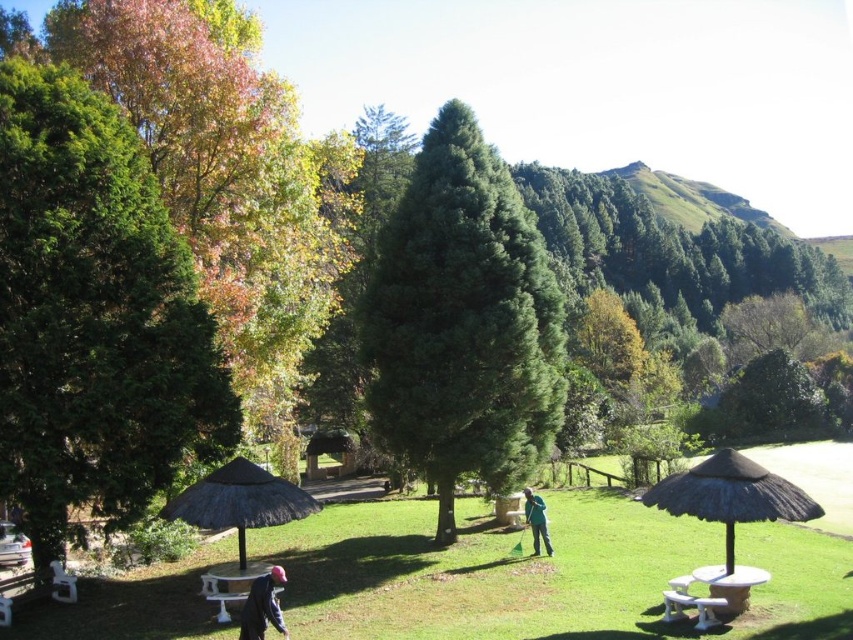
Consider the image. You are planning to set up a picnic under the black thatched umbrella at lower right. However, you need to ensure there is enough space for a 2m tall tent. Is the green matte tree at center an obstruction?

The green matte tree at center is positioned over the black thatched umbrella at lower right, which means the tree is directly above the umbrella. This would likely obstruct the placement of a 2m tall tent underneath, so the tree is an obstruction.

You are planning to place a 1.2 meter wide backpack on the ground between the dark blue jacket at lower left and the white glossy picnic table at lower left. Considering their widths, will the backpack fit without overlapping either object?

The dark blue jacket at lower left has a lesser width compared to the white glossy picnic table at lower left. Since the backpack is 1.2 meters wide, it depends on the available space between them. However, the description only provides relative width information, not the distance between the objects. Without knowing the exact distance, we cannot determine if the backpack will fit.

You are planning to set up a picnic in the park and have a large picnic basket. You see the white plastic table at center and the brown thatched hut at center. Which object can accommodate your picnic basket better based on their sizes?

The white plastic table at center has a larger size compared to the brown thatched hut at center, so it can accommodate the picnic basket better.